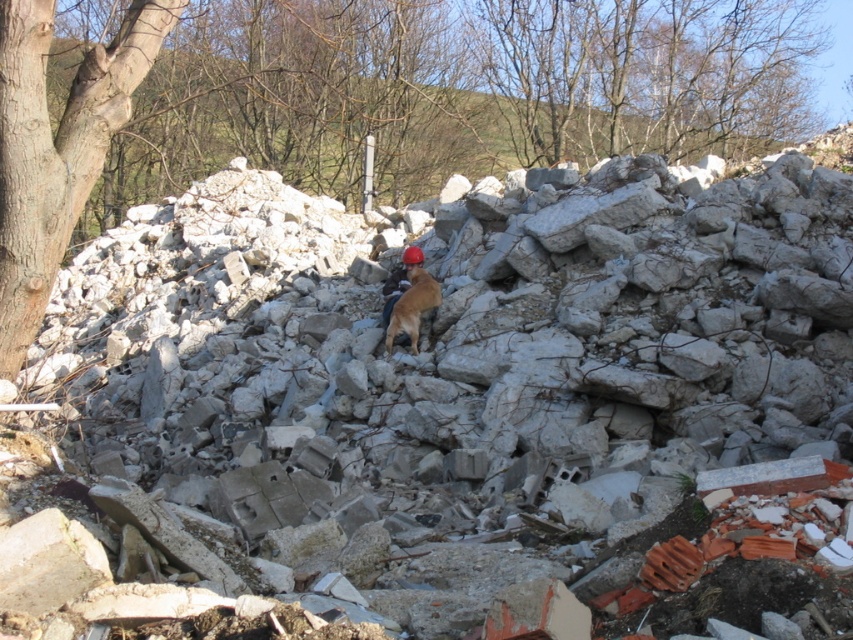
Question: From the image, what is the correct spatial relationship of smooth brown tree trunk at left in relation to matte orange helmet at center?

Choices:
 (A) above
 (B) below

Answer: (A)

Question: Which object appears farthest from the camera in this image?

Choices:
 (A) brown furry dog at center
 (B) matte orange helmet at center
 (C) brown bark tree at upper left

Answer: (B)

Question: Which of the following is the farthest from the observer?

Choices:
 (A) (16, 164)
 (B) (273, 109)

Answer: (B)

Question: Does brown furry dog at center come in front of matte orange helmet at center?

Choices:
 (A) yes
 (B) no

Answer: (A)

Question: Which object is closer to the camera taking this photo?

Choices:
 (A) brown bark tree at upper left
 (B) brown furry dog at center
 (C) smooth brown tree trunk at left
 (D) matte orange helmet at center

Answer: (C)

Question: Does brown furry dog at center appear on the right side of matte orange helmet at center?

Choices:
 (A) no
 (B) yes

Answer: (B)